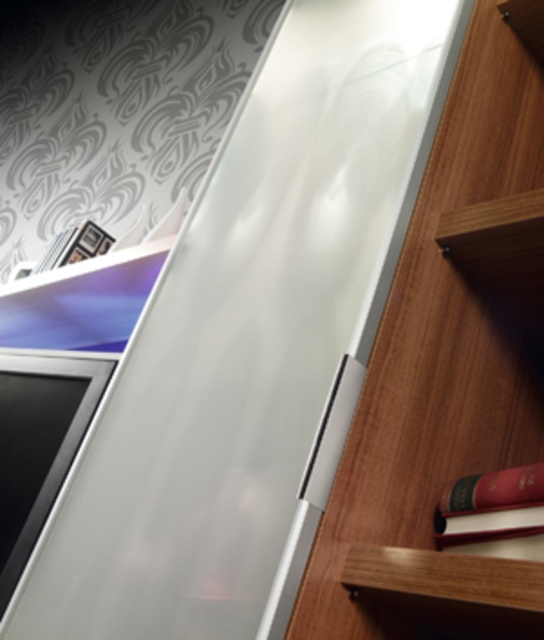
Who is taller, red leather book at lower right or wooden bookcase at right?

wooden bookcase at right is taller.

Is red leather book at lower right in front of wooden bookcase at right?

No, red leather book at lower right is further to the viewer.

Is point (533, 518) farther from viewer compared to point (542, 180)?

No, it is not.

Identify the location of red leather book at lower right. (491, 506).